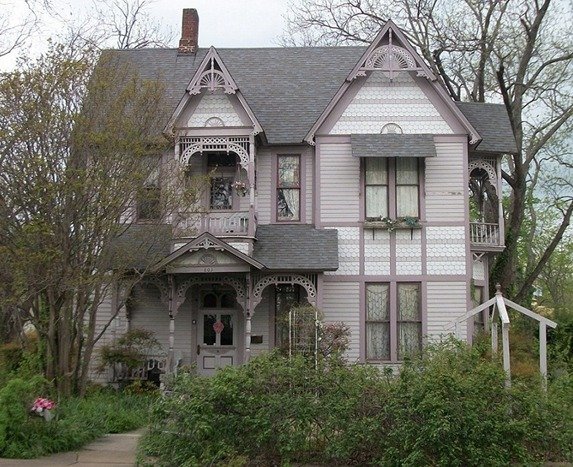
At what (x,y) coordinates should I click in order to perform the action: click on the front door. Please return your answer as a coordinate pair (x, y). Image resolution: width=573 pixels, height=467 pixels. Looking at the image, I should click on (211, 360).